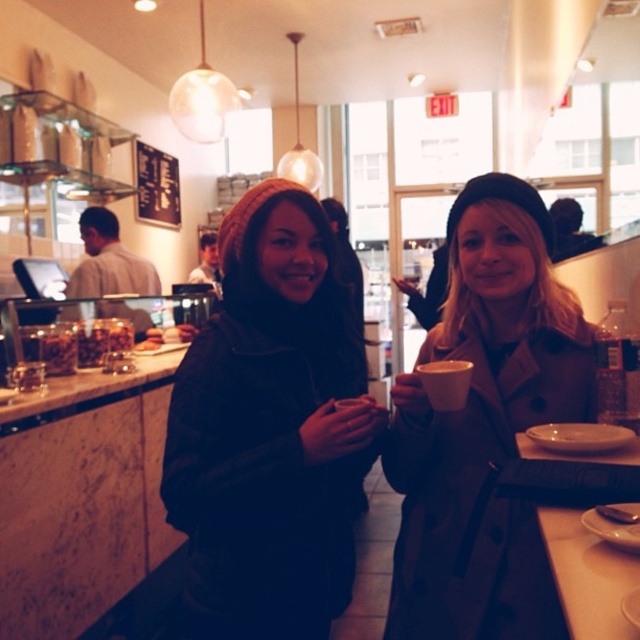
In the scene shown: Which is above, matte gray coat at center or clear plastic bottle at right?

clear plastic bottle at right is above.

Can you confirm if matte gray coat at center is wider than clear plastic bottle at right?

Correct, the width of matte gray coat at center exceeds that of clear plastic bottle at right.

Is point (467, 300) closer to viewer compared to point (600, 392)?

No, it is behind (600, 392).

Where is `matte gray coat at center`? matte gray coat at center is located at coordinates (484, 426).

Between matte black beanie at center and clear plastic bottle at right, which one has more height?

With more height is matte black beanie at center.

In the scene shown: Is matte black beanie at center behind clear plastic bottle at right?

No, matte black beanie at center is closer to the viewer.

Who is more distant from viewer, [356,456] or [625,305]?

The point [356,456] is behind.

Find the location of a particular element. The width and height of the screenshot is (640, 640). matte black beanie at center is located at coordinates (269, 429).

Is matte black beanie at center positioned at the back of matte gray coat at center?

Yes, it is.

Who is positioned more to the right, matte black beanie at center or matte gray coat at center?

From the viewer's perspective, matte gray coat at center appears more on the right side.

Does point (276, 355) come behind point (506, 556)?

No, it is in front of (506, 556).

Identify the location of matte black beanie at center. Image resolution: width=640 pixels, height=640 pixels. (269, 429).